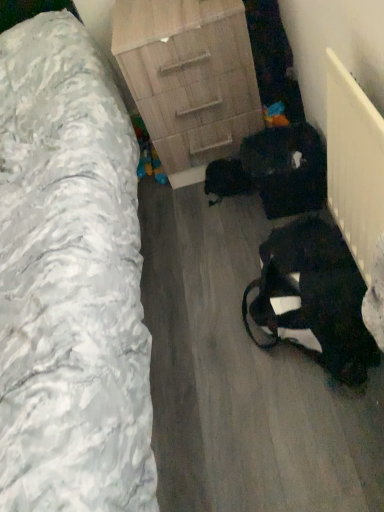
Question: In terms of size, does wooden nightstand at center appear bigger or smaller than wooden chest of drawers at center?

Choices:
 (A) big
 (B) small

Answer: (A)

Question: In the image, is wooden nightstand at center positioned in front of or behind wooden chest of drawers at center?

Choices:
 (A) front
 (B) behind

Answer: (A)

Question: Which object is positioned closest to the black fabric bag at lower right?

Choices:
 (A) wooden nightstand at center
 (B) wooden chest of drawers at center

Answer: (A)

Question: Estimate the real-world distances between objects in this image. Which object is closer to the wooden nightstand at center?

Choices:
 (A) black fabric bag at lower right
 (B) wooden chest of drawers at center

Answer: (B)